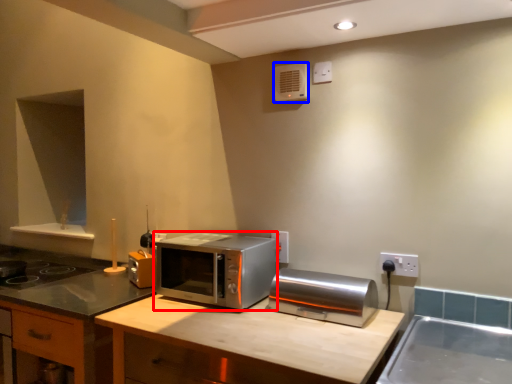
Question: Among these objects, which one is nearest to the camera, microwave oven (highlighted by a red box) or air conditioner (highlighted by a blue box)?

Choices:
 (A) microwave oven
 (B) air conditioner

Answer: (A)